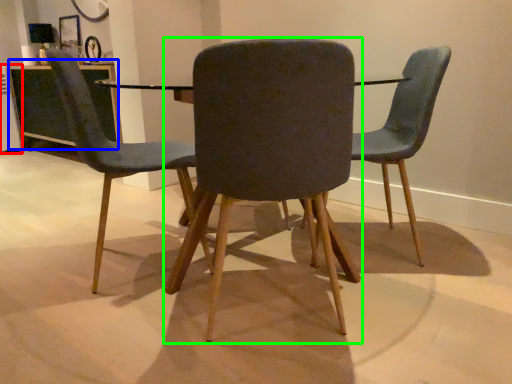
Question: Which object is the closest to the appliance (highlighted by a red box)? Choose among these: table (highlighted by a blue box) or chair (highlighted by a green box).

Choices:
 (A) table
 (B) chair

Answer: (A)